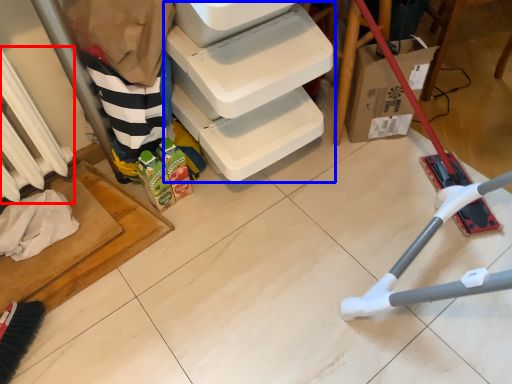
Question: Which object appears closest to the camera in this image, radiator (highlighted by a red box) or shelf (highlighted by a blue box)?

Choices:
 (A) radiator
 (B) shelf

Answer: (B)